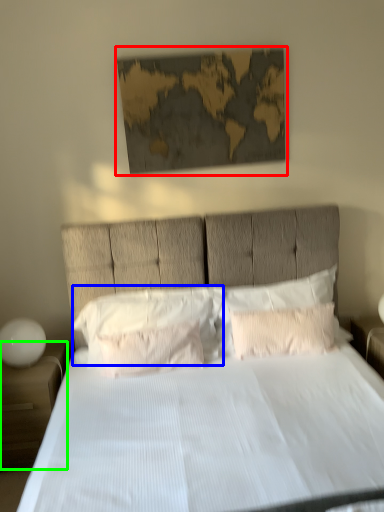
Question: Based on their relative distances, which object is farther from picture frame (highlighted by a red box)? Choose from pillow (highlighted by a blue box) and nightstand (highlighted by a green box).

Choices:
 (A) pillow
 (B) nightstand

Answer: (B)